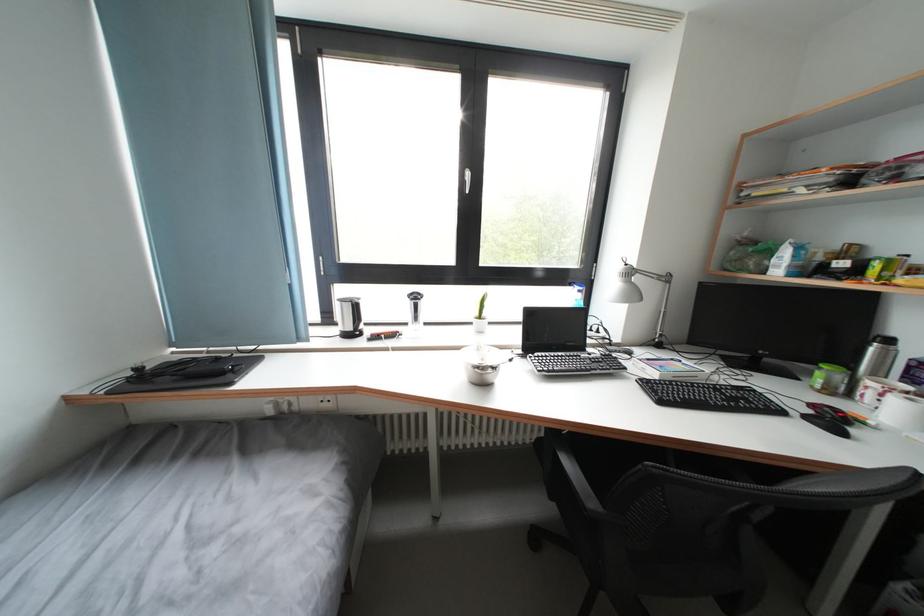
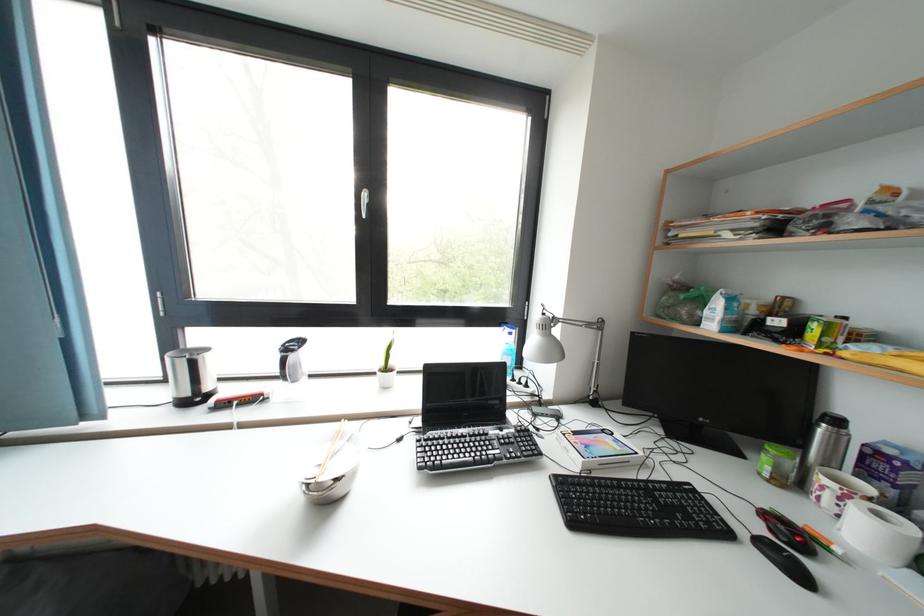
Which direction would the cameraman need to move to produce the second image?

The cameraman moved toward right, forward.